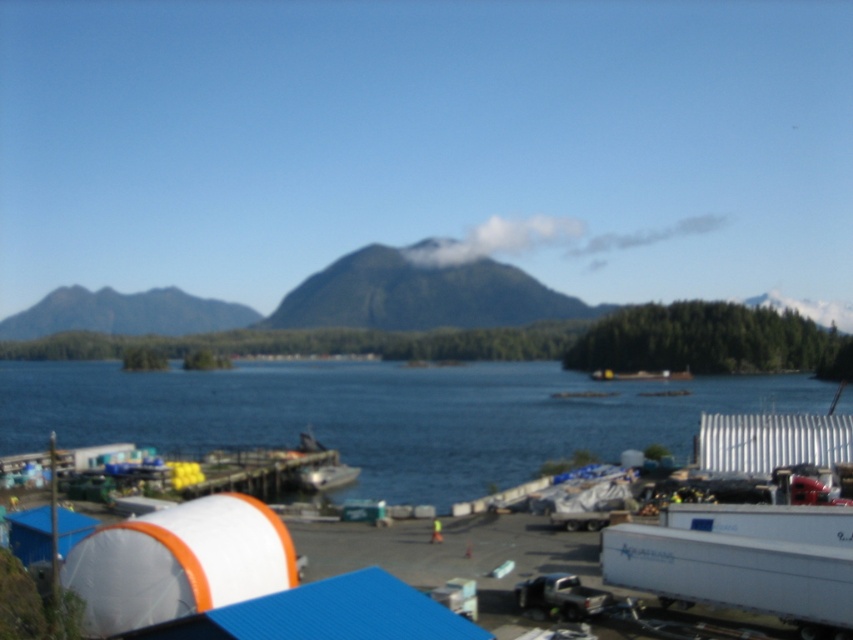
Question: Which is farther from the blue water at center?

Choices:
 (A) green textured mountain at upper left
 (B) green grassy mountain at center

Answer: (A)

Question: Which object appears farthest from the camera in this image?

Choices:
 (A) green textured mountain at upper left
 (B) blue water at center

Answer: (A)

Question: From the image, what is the correct spatial relationship of green grassy mountain at center in relation to green textured mountain at upper left?

Choices:
 (A) left
 (B) right

Answer: (B)

Question: Which of these objects is positioned closest to the blue water at center?

Choices:
 (A) green textured mountain at upper left
 (B) green grassy mountain at center

Answer: (B)

Question: Is green grassy mountain at center smaller than green textured mountain at upper left?

Choices:
 (A) yes
 (B) no

Answer: (B)

Question: Does blue water at center have a smaller size compared to green grassy mountain at center?

Choices:
 (A) no
 (B) yes

Answer: (A)